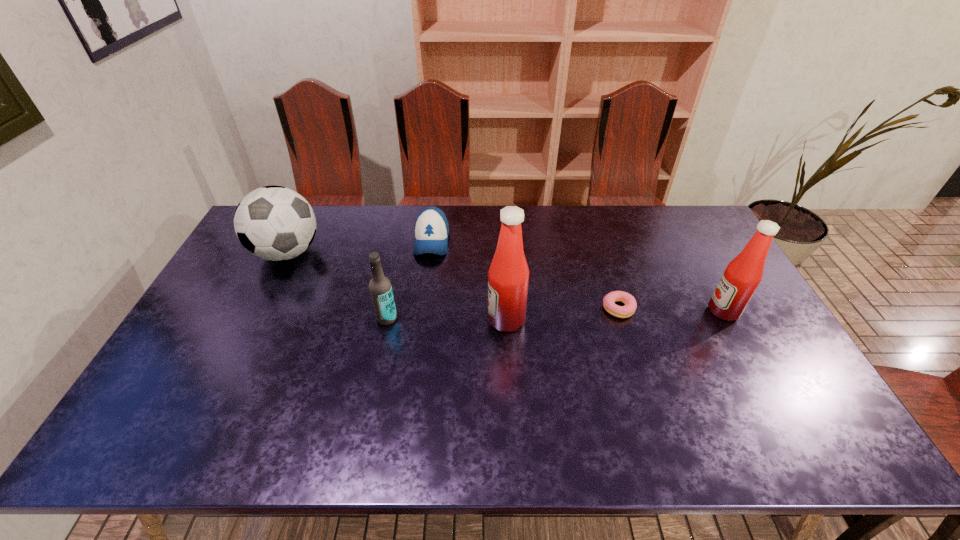
Where is `free point that keeps the condiments evenly spaced on the left`? The image size is (960, 540). free point that keeps the condiments evenly spaced on the left is located at coordinates (279, 329).